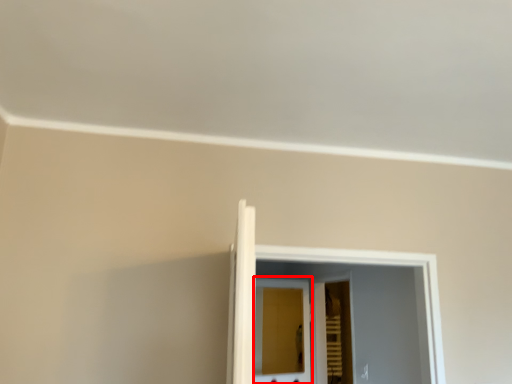
Question: From the image, what is the correct spatial relationship of screen door (annotated by the red box) in relation to screen door?

Choices:
 (A) right
 (B) left

Answer: (B)